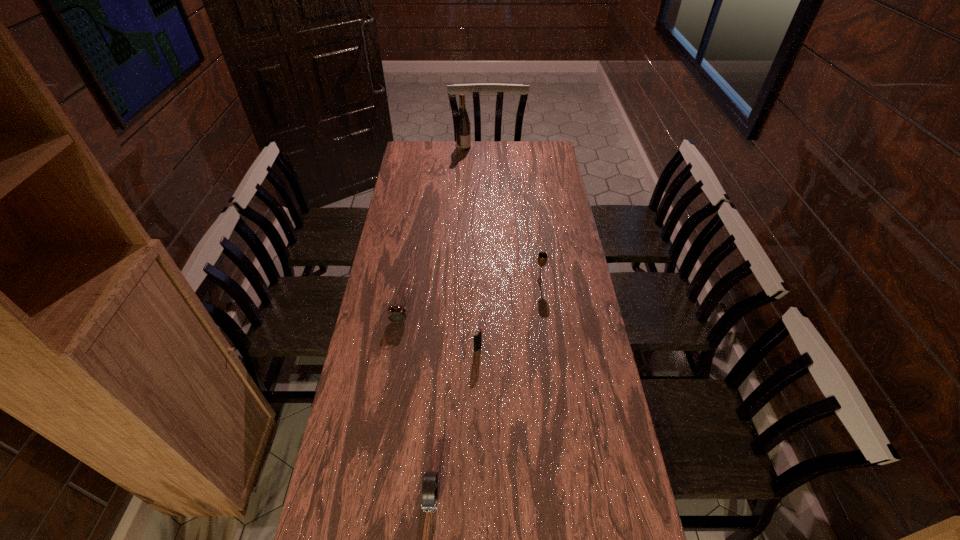
You are a GUI agent. You are given a task and a screenshot of the screen. Output one action in this format:
    pyautogui.click(x=<x>, y=<y>)
    Task: Click on the empty space between the leftmost object and the nearest object
    Image resolution: width=960 pixels, height=540 pixels.
    Given the screenshot: What is the action you would take?
    pyautogui.click(x=416, y=409)

This screenshot has height=540, width=960. I want to click on vacant point located between the rightmost object and the third nearest object, so click(469, 301).

At what (x,y) coordinates should I click in order to perform the action: click on unoccupied position between the chalice and the nearest object. Please return your answer as a coordinate pair (x, y). Image resolution: width=960 pixels, height=540 pixels. Looking at the image, I should click on (486, 389).

Where is `vacant space in between the tallest object and the second farthest object`? The image size is (960, 540). vacant space in between the tallest object and the second farthest object is located at coordinates (501, 214).

You are a GUI agent. You are given a task and a screenshot of the screen. Output one action in this format:
    pyautogui.click(x=<x>, y=<y>)
    Task: Click on the free area in between the watch and the chalice
    This screenshot has width=960, height=540.
    Given the screenshot: What is the action you would take?
    pyautogui.click(x=486, y=389)

Where is `unoccupied area between the second nearest object and the third farthest object`? unoccupied area between the second nearest object and the third farthest object is located at coordinates [x=439, y=335].

Select which object is the fourth closest to the rightmost object. Please provide its 2D coordinates. Your answer should be formatted as a tuple, i.e. [(x, y)], where the tuple contains the x and y coordinates of a point satisfying the conditions above.

[(463, 132)]

Identify which object is located as the fourth nearest to the farthest object. Please provide its 2D coordinates. Your answer should be formatted as a tuple, i.e. [(x, y)], where the tuple contains the x and y coordinates of a point satisfying the conditions above.

[(429, 494)]

You are a GUI agent. You are given a task and a screenshot of the screen. Output one action in this format:
    pyautogui.click(x=<x>, y=<y>)
    Task: Click on the vacant point that satisfies the following two spatial constraints: 1. on the face of the fourth object from left to right; 2. on the right side of the alarm clock
    This screenshot has width=960, height=540.
    Given the screenshot: What is the action you would take?
    pyautogui.click(x=395, y=349)